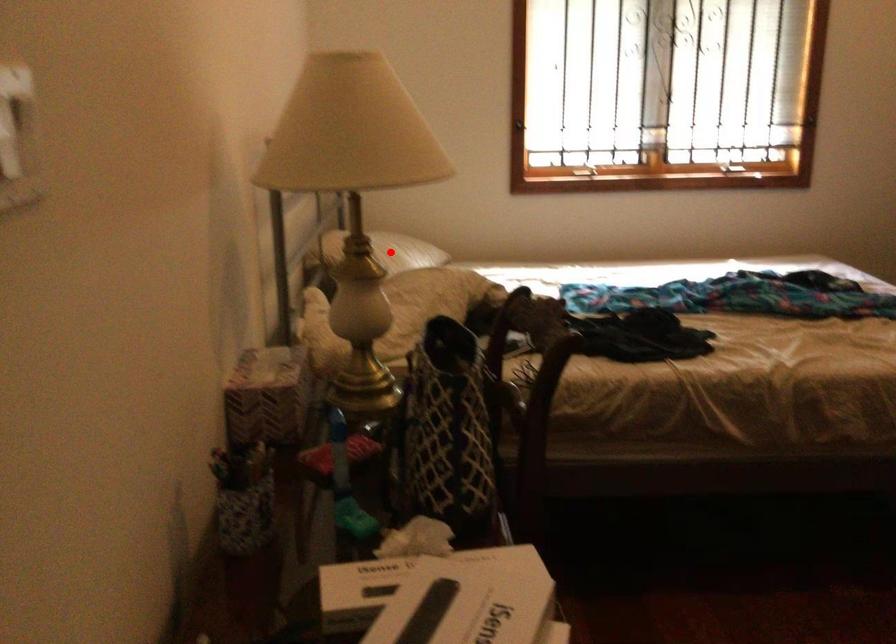
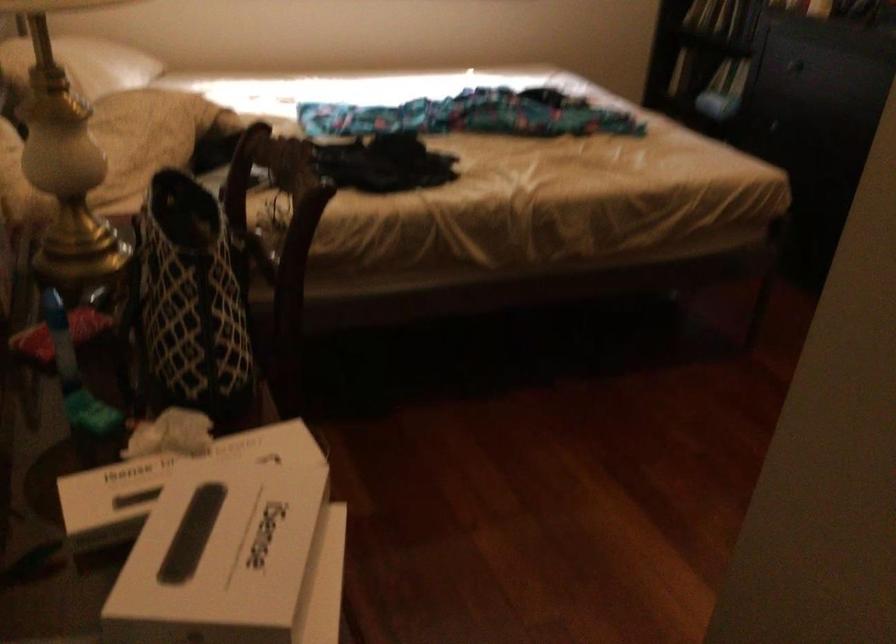
Question: I am providing you with two images of the same scene from different viewpoints. Image1 has a red point marked. In image2, the corresponding 3D location appears at what relative position? Reply with the corresponding letter.

Choices:
 (A) Closer
 (B) Farther

Answer: (A)